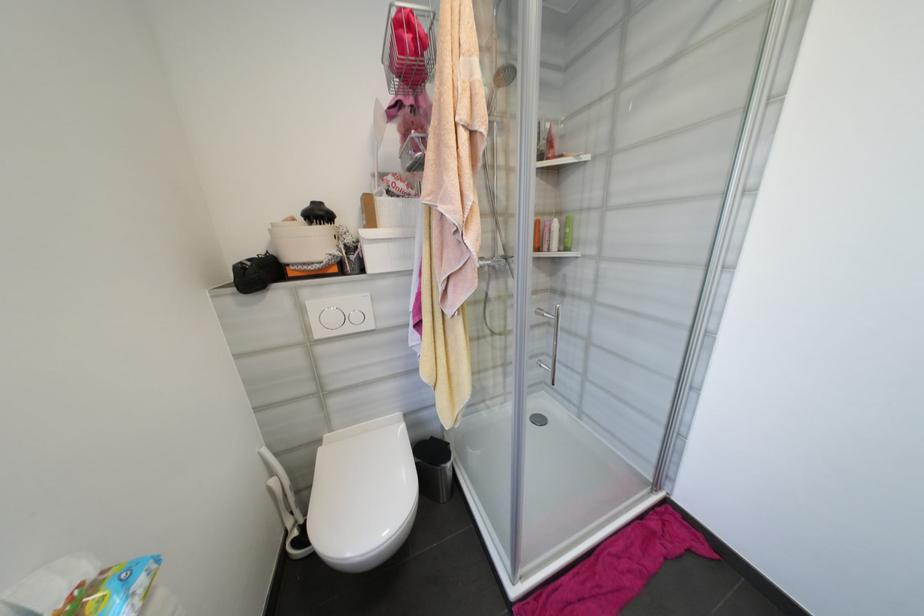
Where would you push the large flush button? Please return your answer as a coordinate pair (x, y).

(339, 317)